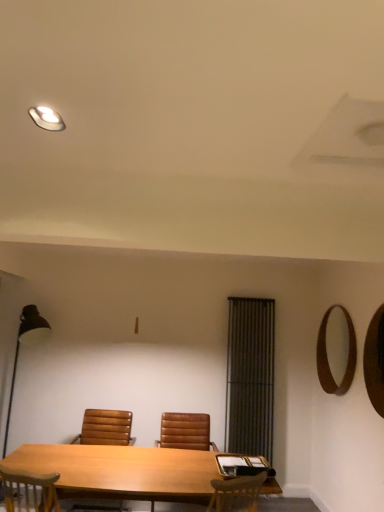
Question: Considering the positions of point (13, 386) and point (322, 364), is point (13, 386) closer or farther from the camera than point (322, 364)?

Choices:
 (A) closer
 (B) farther

Answer: (B)

Question: Visually, is black metal floor lamp at left positioned to the left or to the right of brown wooden mirror at upper right, which ranks as the second mirror in front-to-back order?

Choices:
 (A) right
 (B) left

Answer: (B)

Question: Estimate the real-world distances between objects in this image. Which object is farther from the brown wooden mirror at upper right, which is the first mirror from back to front?

Choices:
 (A) brown leather chair at center, placed as the first chair when sorted from left to right
 (B) matte white light fixture at upper left
 (C) wooden mirror at right, the second mirror from the back
 (D) black metal floor lamp at left
 (E) black fabric curtain at center

Answer: (B)

Question: Based on their relative distances, which object is nearer to the black metal floor lamp at left?

Choices:
 (A) brown leather chair at center, arranged as the 2th chair when viewed from the left
 (B) black fabric curtain at center
 (C) light brown wood table at center
 (D) brown leather chair at center, arranged as the second chair when viewed from the right
 (E) brown wooden mirror at upper right, which ranks as the second mirror in front-to-back order

Answer: (D)